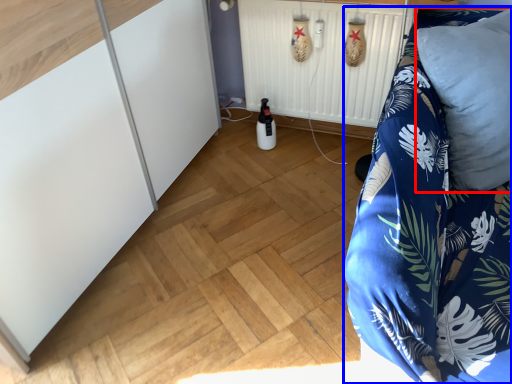
Question: Which of the following is the closest to the observer, pillow (highlighted by a red box) or furniture (highlighted by a blue box)?

Choices:
 (A) pillow
 (B) furniture

Answer: (B)